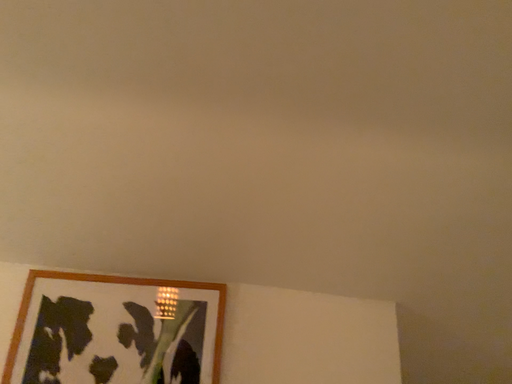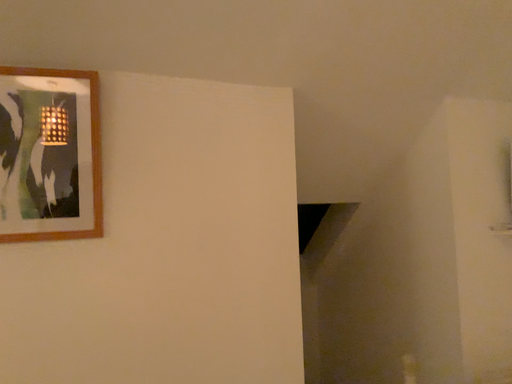
Question: Which way did the camera rotate in the video?

Choices:
 (A) rotated downward
 (B) rotated upward

Answer: (A)